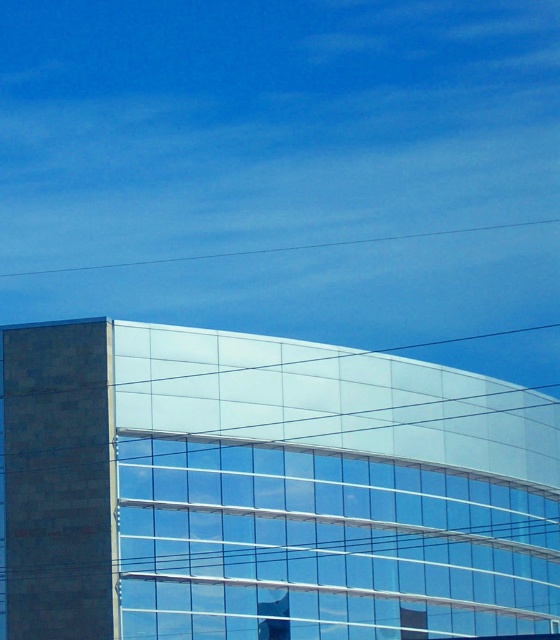
You are an architect reviewing the building facade. You notice the transparent glass window at center and the metallic glass window at center. Which one appears closer to you when observing the building from the street?

The transparent glass window at center appears closer because it is in front of the metallic glass window at center.

You are standing in front of the modern building and want to determine the relative positions of two points marked on its facade. The points are labeled as point 1 at coordinates point (444, 572) and point 2 at coordinates point (258, 611). Which point is closer to you?

Point (444, 572) is further to the viewer than point (258, 611), so point (258, 611) is closer to you.

You are an architect reviewing the building design. You need to determine the vertical arrangement of the transparent glass window at center and the metallic glass window at center. Which one is positioned higher on the building?

The transparent glass window at center is positioned higher because it is located above the metallic glass window at center.